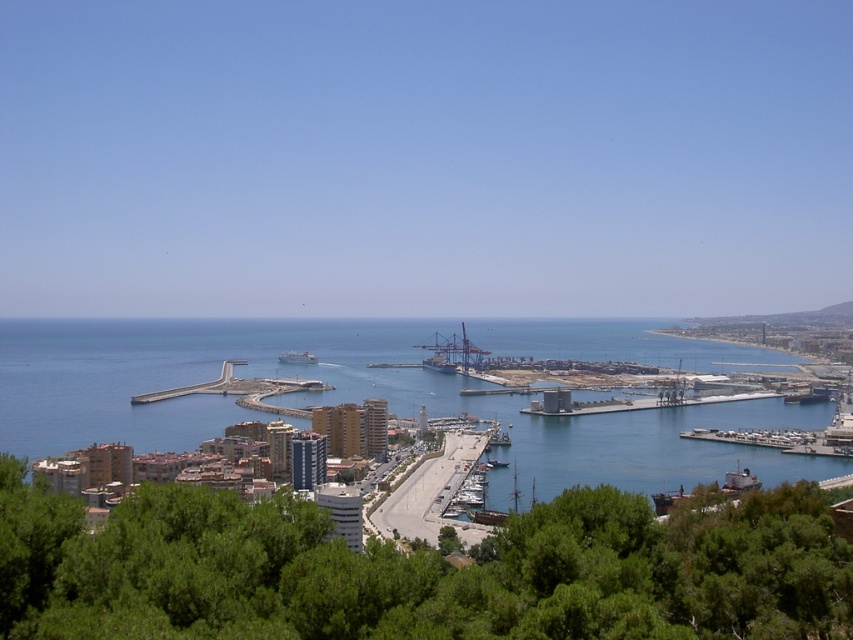
Question: Which point is farther to the camera?

Choices:
 (A) white matte ship at center
 (B) blue water at center
 (C) gray concrete dock at center

Answer: (A)

Question: Does gray concrete dock at center appear on the right side of metallic blue cargo ship at center?

Choices:
 (A) no
 (B) yes

Answer: (B)

Question: Which of the following is the closest to the observer?

Choices:
 (A) gray concrete dock at center
 (B) metallic blue cargo ship at center

Answer: (B)

Question: Estimate the real-world distances between objects in this image. Which object is closer to the metallic blue cargo ship at center?

Choices:
 (A) blue water at center
 (B) gray concrete dock at center
 (C) white matte ship at center

Answer: (B)

Question: Does blue water at center appear over metallic blue cargo ship at center?

Choices:
 (A) no
 (B) yes

Answer: (A)

Question: Can you confirm if blue water at center is smaller than gray concrete dock at center?

Choices:
 (A) yes
 (B) no

Answer: (B)